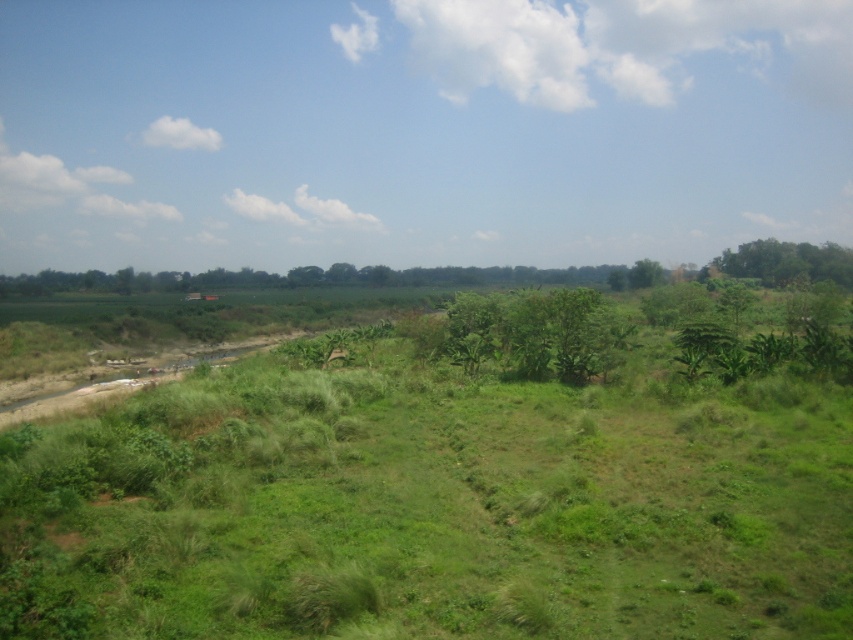
Can you confirm if green leafy tree at center is wider than green leafy tree at upper right?

Incorrect, green leafy tree at center's width does not surpass green leafy tree at upper right's.

Does point (524, 364) lie behind point (795, 280)?

That is False.

Find the location of a particular element. green leafy tree at center is located at coordinates (538, 333).